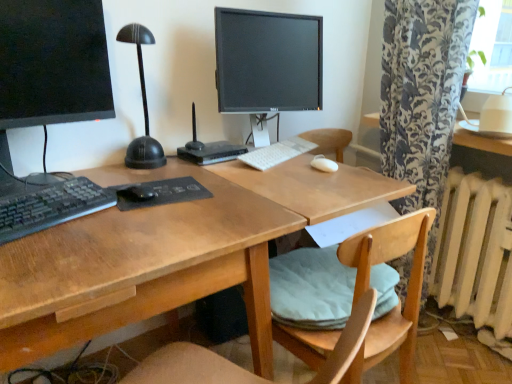
What is the approximate width of matte black monitor at center, the first computer monitor from the back?

The width of matte black monitor at center, the first computer monitor from the back, is 7.41 inches.

At what (x,y) coordinates should I click in order to perform the action: click on white plastic keyboard at center. Please return your answer as a coordinate pair (x, y). Looking at the image, I should click on (277, 153).

In order to face matte black monitor at left, placed as the 1th computer monitor when sorted from left to right, should I rotate leftwards or rightwards?

It's best to rotate left around 25.842 degrees.

Where is `translucent plastic keyboard at left`? The image size is (512, 384). translucent plastic keyboard at left is located at coordinates (51, 207).

Locate an element on the screen. This screenshot has width=512, height=384. white painted metal radiator at lower right is located at coordinates (476, 256).

Image resolution: width=512 pixels, height=384 pixels. I want to click on white matte mouse at center, so click(x=323, y=164).

You are a GUI agent. You are given a task and a screenshot of the screen. Output one action in this format:
    pyautogui.click(x=<x>, y=<y>)
    Task: Click on the matte black monitor at center, placed as the second computer monitor when sorted from left to right
    The image size is (512, 384).
    Given the screenshot: What is the action you would take?
    pyautogui.click(x=268, y=61)

Does matte black monitor at left, marked as the second computer monitor in a right-to-left arrangement, appear on the right side of black plastic router at center?

In fact, matte black monitor at left, marked as the second computer monitor in a right-to-left arrangement, is to the left of black plastic router at center.

Is point (38, 51) behind point (216, 156)?

No, (38, 51) is in front of (216, 156).

Does matte black monitor at left, placed as the 1th computer monitor when sorted from left to right, have a larger size compared to black plastic router at center?

Yes, matte black monitor at left, placed as the 1th computer monitor when sorted from left to right, is bigger than black plastic router at center.

Between white plastic keyboard at center and matte black monitor at left, which is the 2th computer monitor in back-to-front order, which one has larger width?

With larger width is matte black monitor at left, which is the 2th computer monitor in back-to-front order.

Is white plastic keyboard at center bigger than matte black monitor at left, which is the 2th computer monitor in back-to-front order?

No, white plastic keyboard at center is not bigger than matte black monitor at left, which is the 2th computer monitor in back-to-front order.

From the image's perspective, would you say white plastic keyboard at center is positioned over matte black monitor at left, which is counted as the first computer monitor, starting from the front?

No, from the image's perspective, white plastic keyboard at center is not over matte black monitor at left, which is counted as the first computer monitor, starting from the front.

Is white plastic keyboard at center facing towards matte black monitor at left, marked as the second computer monitor in a right-to-left arrangement?

No, white plastic keyboard at center does not turn towards matte black monitor at left, marked as the second computer monitor in a right-to-left arrangement.

From the image's perspective, relative to white painted metal radiator at lower right, is white matte mouse at center above or below?

white matte mouse at center is situated higher than white painted metal radiator at lower right in the image.

Is white matte mouse at center taller or shorter than white painted metal radiator at lower right?

Considering their sizes, white matte mouse at center has less height than white painted metal radiator at lower right.

Looking at their sizes, would you say white matte mouse at center is wider or thinner than white painted metal radiator at lower right?

In the image, white matte mouse at center appears to be more narrow than white painted metal radiator at lower right.

Which object is thinner, black plastic router at center or translucent plastic keyboard at left?

translucent plastic keyboard at left is thinner.

Measure the distance between black plastic router at center and translucent plastic keyboard at left.

black plastic router at center and translucent plastic keyboard at left are 19.51 inches apart from each other.

What are the coordinates of `computer keyboard in front of the black plastic router at center` in the screenshot? It's located at (51, 207).

Does black plastic router at center contain translucent plastic keyboard at left?

No, translucent plastic keyboard at left is not inside black plastic router at center.

Which object is thinner, white painted metal radiator at lower right or matte black monitor at center, which appears as the 1th computer monitor when viewed from the right?

With smaller width is matte black monitor at center, which appears as the 1th computer monitor when viewed from the right.

Are white painted metal radiator at lower right and matte black monitor at center, placed as the second computer monitor when sorted from left to right, far apart?

No.

In the image, is white painted metal radiator at lower right positioned in front of or behind matte black monitor at center, acting as the second computer monitor starting from the front?

white painted metal radiator at lower right is positioned farther from the viewer than matte black monitor at center, acting as the second computer monitor starting from the front.

Is white painted metal radiator at lower right taller or shorter than matte black monitor at center, placed as the second computer monitor when sorted from left to right?

Clearly, white painted metal radiator at lower right is taller compared to matte black monitor at center, placed as the second computer monitor when sorted from left to right.

From a real-world perspective, is matte black monitor at left, which is counted as the first computer monitor, starting from the front, located beneath wooden desk at center?

No.

Considering the relative positions of matte black monitor at left, which is counted as the first computer monitor, starting from the front, and wooden desk at center in the image provided, is matte black monitor at left, which is counted as the first computer monitor, starting from the front, to the left or to the right of wooden desk at center?

matte black monitor at left, which is counted as the first computer monitor, starting from the front, is positioned on wooden desk at center's left side.

Considering the relative sizes of matte black monitor at left, marked as the second computer monitor in a right-to-left arrangement, and wooden desk at center in the image provided, is matte black monitor at left, marked as the second computer monitor in a right-to-left arrangement, shorter than wooden desk at center?

Indeed, matte black monitor at left, marked as the second computer monitor in a right-to-left arrangement, has a lesser height compared to wooden desk at center.

Considering the points (292, 35) and (219, 241), which point is behind, point (292, 35) or point (219, 241)?

Positioned behind is point (292, 35).

Is matte black monitor at center, placed as the second computer monitor when sorted from left to right, looking in the opposite direction of wooden desk at center?

No, matte black monitor at center, placed as the second computer monitor when sorted from left to right, is not facing the opposite direction of wooden desk at center.

From a real-world perspective, is matte black monitor at center, acting as the second computer monitor starting from the front, above or below wooden desk at center?

matte black monitor at center, acting as the second computer monitor starting from the front, is situated higher than wooden desk at center in the real world.

Is wooden desk at center located within matte black monitor at center, the first computer monitor from the back?

No, wooden desk at center is not inside matte black monitor at center, the first computer monitor from the back.

From the image's perspective, starting from the black plastic router at center, which computer monitor is the 1st one above? Please provide its 2D coordinates.

[(53, 63)]

At what (x,y) coordinates should I click in order to perform the action: click on keyboard behind the matte black monitor at left, marked as the second computer monitor in a right-to-left arrangement. Please return your answer as a coordinate pair (x, y). Looking at the image, I should click on (277, 153).

Considering their positions, is white plastic keyboard at center positioned further to black plastic router at center than white painted metal radiator at lower right?

white painted metal radiator at lower right is further to black plastic router at center.

Based on their spatial positions, is white painted metal radiator at lower right or white plastic keyboard at center further from translucent plastic keyboard at left?

white painted metal radiator at lower right is positioned further to the anchor translucent plastic keyboard at left.

Which object lies further to the anchor point wooden desk at center, matte black monitor at center, the first computer monitor from the back, or white painted metal radiator at lower right?

white painted metal radiator at lower right lies further to wooden desk at center than the other object.

From the image, which object appears to be nearer to white plastic keyboard at center, black plastic router at center or white painted metal radiator at lower right?

black plastic router at center is positioned closer to the anchor white plastic keyboard at center.

Considering their positions, is white matte mouse at center positioned further to white painted metal radiator at lower right than matte black monitor at left, which is counted as the first computer monitor, starting from the front?

Based on the image, matte black monitor at left, which is counted as the first computer monitor, starting from the front, appears to be further to white painted metal radiator at lower right.

From the image, which object appears to be nearer to matte black monitor at center, acting as the second computer monitor starting from the front, translucent plastic keyboard at left or light wood chair at center?

translucent plastic keyboard at left is positioned closer to the anchor matte black monitor at center, acting as the second computer monitor starting from the front.

Based on their spatial positions, is white matte mouse at center or matte black monitor at center, placed as the second computer monitor when sorted from left to right, closer to translucent plastic keyboard at left?

matte black monitor at center, placed as the second computer monitor when sorted from left to right.

Considering their positions, is white matte mouse at center positioned further to translucent plastic keyboard at left than black plastic router at center?

Among the two, white matte mouse at center is located further to translucent plastic keyboard at left.

Where is `computer located between wooden desk at center and white painted metal radiator at lower right in the left-right direction`? This screenshot has height=384, width=512. computer located between wooden desk at center and white painted metal radiator at lower right in the left-right direction is located at coordinates (208, 149).

Image resolution: width=512 pixels, height=384 pixels. Identify the location of computer monitor between black plastic router at center and white plastic keyboard at center. (268, 61).

Identify the location of chair located between matte black monitor at center, placed as the second computer monitor when sorted from left to right, and white painted metal radiator at lower right in the left-right direction. (369, 307).

The width and height of the screenshot is (512, 384). I want to click on computer keyboard between matte black monitor at center, the first computer monitor from the back, and wooden desk at center in the up-down direction, so click(x=51, y=207).